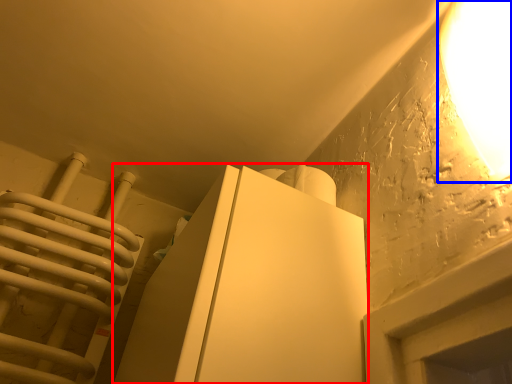
Question: Which of the following is the farthest to the observer, furniture (highlighted by a red box) or lamp (highlighted by a blue box)?

Choices:
 (A) furniture
 (B) lamp

Answer: (A)